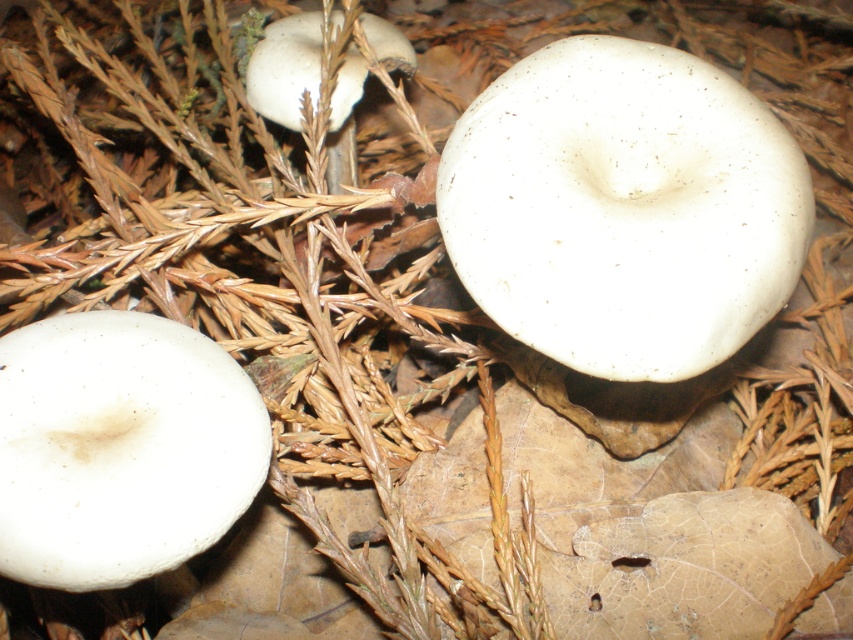
Question: Estimate the real-world distances between objects in this image. Which object is closer to the white matte mushroom at center?

Choices:
 (A) white matte mushroom at lower left
 (B) white matte mushroom at upper center

Answer: (A)

Question: Which of the following is the farthest from the observer?

Choices:
 (A) white matte mushroom at center
 (B) white matte mushroom at lower left
 (C) white matte mushroom at upper center

Answer: (C)

Question: Is white matte mushroom at center closer to camera compared to white matte mushroom at lower left?

Choices:
 (A) yes
 (B) no

Answer: (B)

Question: Where is white matte mushroom at center located in relation to white matte mushroom at lower left in the image?

Choices:
 (A) left
 (B) right

Answer: (B)

Question: Observing the image, what is the correct spatial positioning of white matte mushroom at center in reference to white matte mushroom at lower left?

Choices:
 (A) below
 (B) above

Answer: (B)

Question: Estimate the real-world distances between objects in this image. Which object is farther from the white matte mushroom at center?

Choices:
 (A) white matte mushroom at upper center
 (B) white matte mushroom at lower left

Answer: (A)